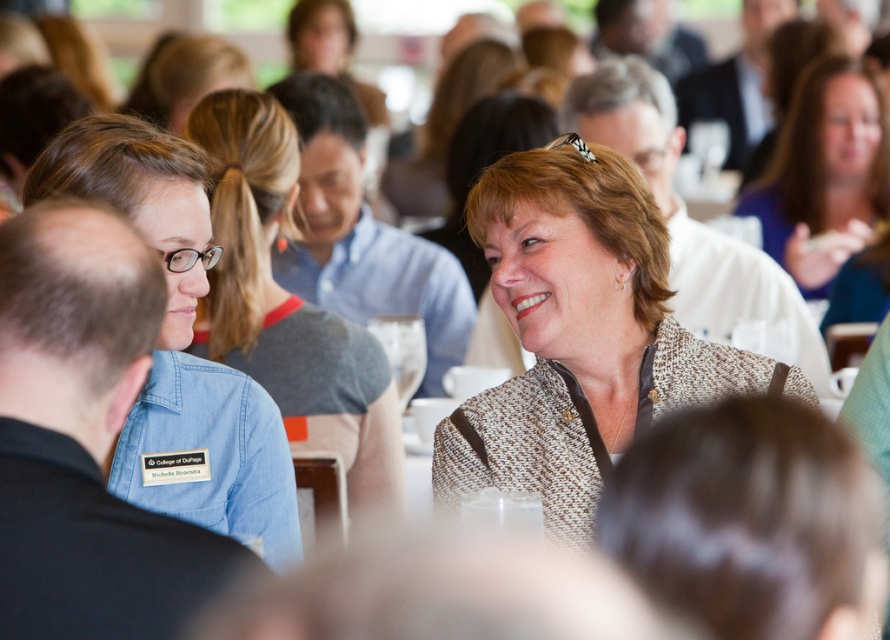
Question: Estimate the real-world distances between objects in this image. Which object is farther from the matte brown blazer at center?

Choices:
 (A) blue denim shirt at center
 (B) brown textured blazer at center

Answer: (B)

Question: Is blue denim shirt at center bigger than matte brown blazer at center?

Choices:
 (A) no
 (B) yes

Answer: (A)

Question: Can you confirm if blue denim shirt at center is bigger than matte brown blazer at center?

Choices:
 (A) no
 (B) yes

Answer: (A)

Question: Can you confirm if blue denim shirt at center is positioned above matte brown blazer at center?

Choices:
 (A) no
 (B) yes

Answer: (A)

Question: Which point is farther to the camera?

Choices:
 (A) brown textured blazer at center
 (B) blue denim shirt at center
 (C) matte brown blazer at center

Answer: (C)

Question: Which object is the closest to the brown textured blazer at center?

Choices:
 (A) blue denim shirt at center
 (B) matte brown blazer at center

Answer: (A)